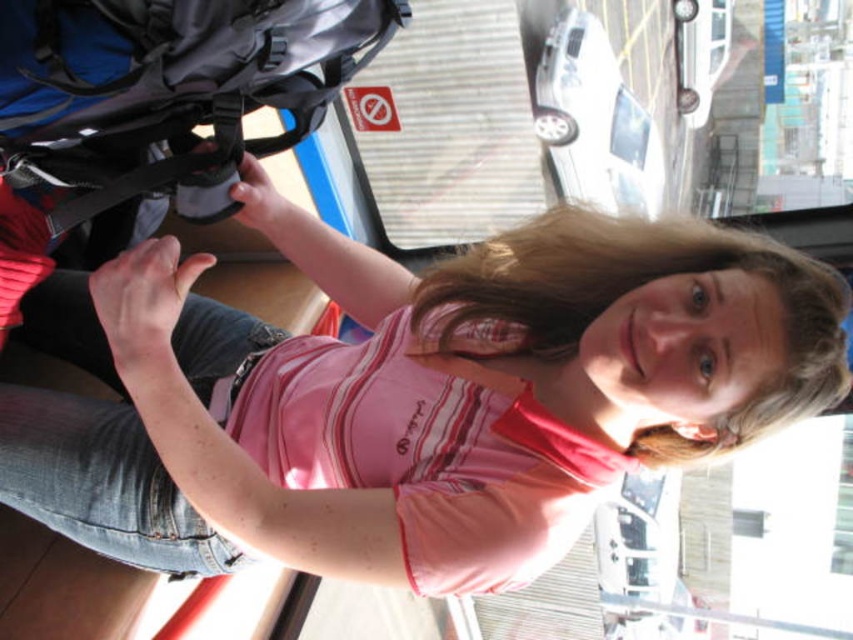
Question: Which object is farther from the camera taking this photo?

Choices:
 (A) pink cotton shirt at center
 (B) matte black backpack at left

Answer: (A)

Question: Can you confirm if pink cotton shirt at center is smaller than matte black backpack at left?

Choices:
 (A) yes
 (B) no

Answer: (B)

Question: Does pink cotton shirt at center have a smaller size compared to matte black backpack at left?

Choices:
 (A) no
 (B) yes

Answer: (A)

Question: Which point is farther to the camera?

Choices:
 (A) pink cotton shirt at center
 (B) matte black backpack at left

Answer: (A)

Question: Among these points, which one is farthest from the camera?

Choices:
 (A) [610, 246]
 (B) [357, 8]

Answer: (A)

Question: Is pink cotton shirt at center thinner than matte black backpack at left?

Choices:
 (A) no
 (B) yes

Answer: (A)